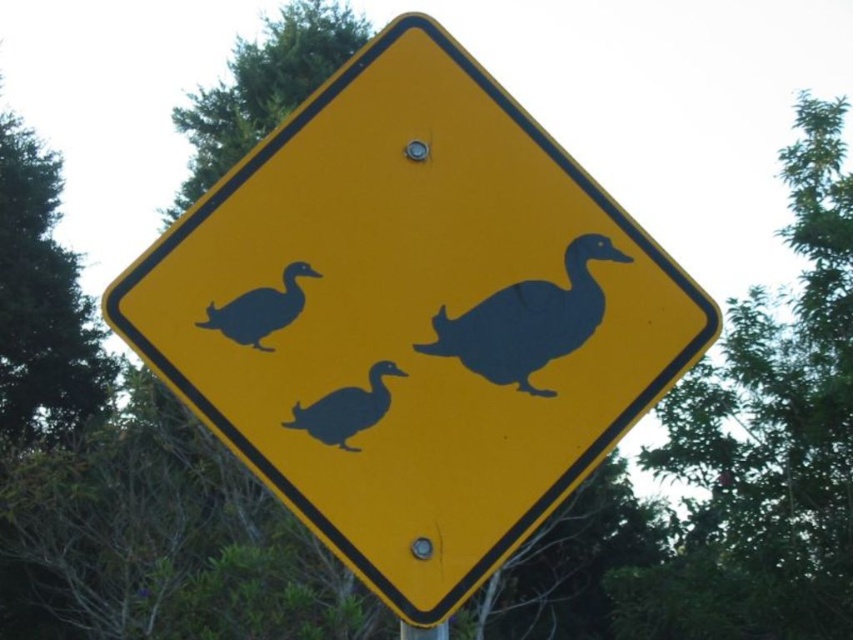
Can you confirm if yellow matte sign at center is smaller than black matte duck at center?

No, yellow matte sign at center is not smaller than black matte duck at center.

Which is above, yellow matte sign at center or black matte duck at center?

yellow matte sign at center

Where is `yellow matte sign at center`? The height and width of the screenshot is (640, 853). yellow matte sign at center is located at coordinates (418, 316).

Can you confirm if matte black duck at center is smaller than black matte duck at upper left?

No, matte black duck at center is not smaller than black matte duck at upper left.

Between point (518, 285) and point (210, 326), which one is positioned behind?

Positioned behind is point (518, 285).

Locate an element on the screen. This screenshot has width=853, height=640. matte black duck at center is located at coordinates (527, 321).

Can you confirm if yellow matte sign at center is shorter than metallic silver pole at lower center?

Incorrect, yellow matte sign at center's height does not fall short of metallic silver pole at lower center's.

Is yellow matte sign at center wider than metallic silver pole at lower center?

Correct, the width of yellow matte sign at center exceeds that of metallic silver pole at lower center.

Locate an element on the screen. The height and width of the screenshot is (640, 853). yellow matte sign at center is located at coordinates (418, 316).